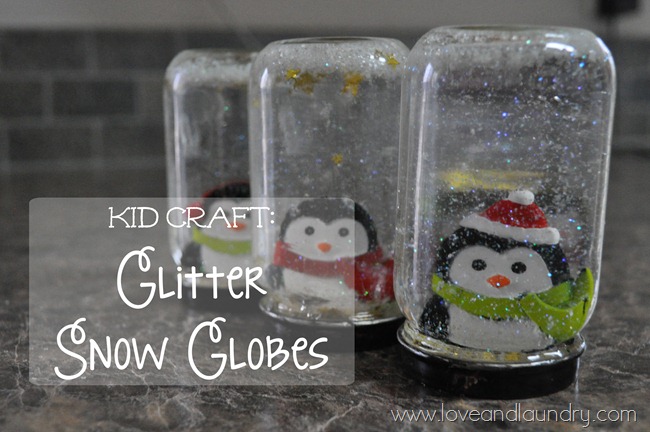
Where is `jars`? The height and width of the screenshot is (432, 650). jars is located at coordinates (494, 135), (341, 122), (205, 121).